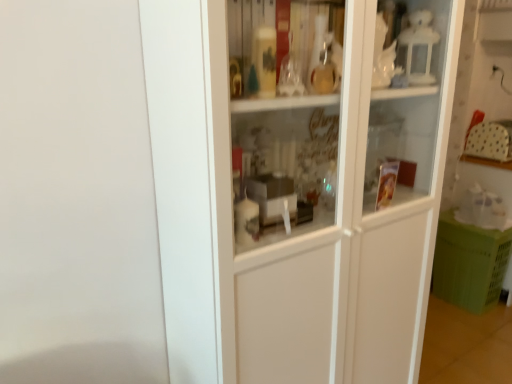
Question: Does point (479, 269) appear closer or farther from the camera than point (387, 297)?

Choices:
 (A) farther
 (B) closer

Answer: (A)

Question: Which is correct: green plastic crate at lower right is inside white glossy cupboard at center, or outside of it?

Choices:
 (A) outside
 (B) inside

Answer: (A)

Question: From the image's perspective, is green plastic crate at lower right located above or below white glossy cupboard at center?

Choices:
 (A) above
 (B) below

Answer: (B)

Question: Considering the positions of white glossy cupboard at center and green plastic crate at lower right in the image, is white glossy cupboard at center bigger or smaller than green plastic crate at lower right?

Choices:
 (A) big
 (B) small

Answer: (A)

Question: Considering the positions of white glossy cupboard at center and green plastic crate at lower right in the image, is white glossy cupboard at center taller or shorter than green plastic crate at lower right?

Choices:
 (A) short
 (B) tall

Answer: (B)

Question: From a real-world perspective, is white glossy cupboard at center physically located above or below green plastic crate at lower right?

Choices:
 (A) above
 (B) below

Answer: (A)

Question: Considering their positions, is white glossy cupboard at center located in front of or behind green plastic crate at lower right?

Choices:
 (A) behind
 (B) front

Answer: (B)